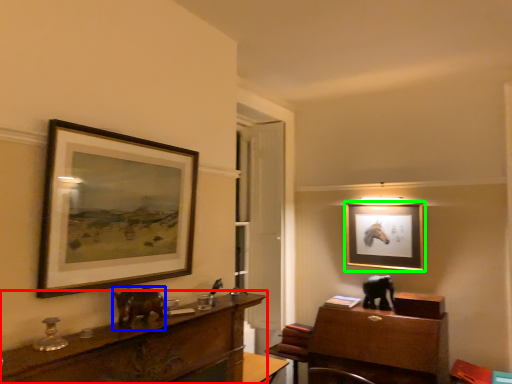
Question: Based on their relative distances, which object is farther from desk (highlighted by a red box)? Choose from animal (highlighted by a blue box) and picture frame (highlighted by a green box).

Choices:
 (A) animal
 (B) picture frame

Answer: (B)